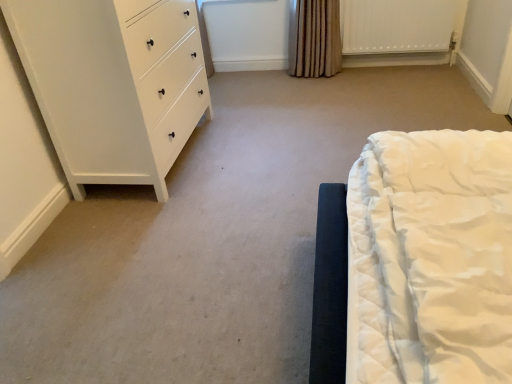
The height and width of the screenshot is (384, 512). Identify the location of vacant space underneath white textured radiator at upper right (from a real-world perspective). (392, 62).